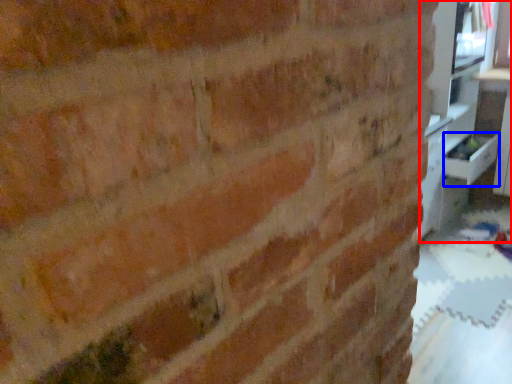
Question: Which object appears farthest to the camera in this image, entertainment center (highlighted by a red box) or drawer (highlighted by a blue box)?

Choices:
 (A) entertainment center
 (B) drawer

Answer: (B)